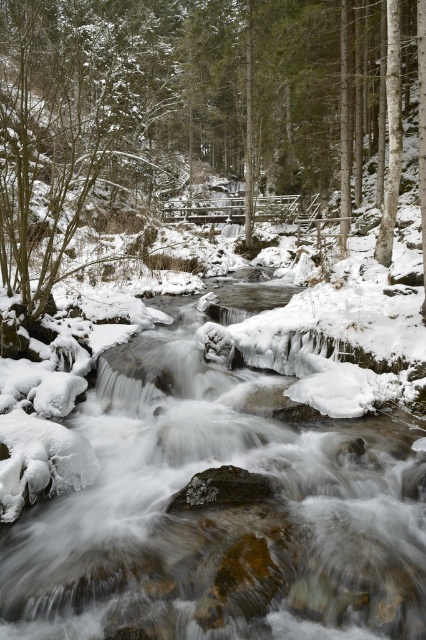
You are standing in the winter forest scene and want to place a small wooden bench between the snowy evergreen tree at center and the snowy bark tree at center. Which tree should the bench be closer to if you want it to be equidistant from both trees?

The bench should be closer to the snowy bark tree at center because the snowy evergreen tree at center might be wider, so positioning the bench closer to the narrower tree would help achieve an equal distance between both trees.

You are a photographer planning to capture a winter landscape. You want to ensure that both the icy smooth water at center and the snowy bark tree at center are visible in your shot. Based on their sizes, which object should you focus on first to frame the composition properly?

The icy smooth water at center is not as tall as the snowy bark tree at center, so you should focus on framing the snowy bark tree at center first since it is taller and will require more space in the composition.

You are standing at the point with coordinates point (2, 252) and want to walk towards the point with coordinates point (25, 449). Which direction should you move relative to your current position?

You should move forward because point (25, 449) is in front of point (2, 252).